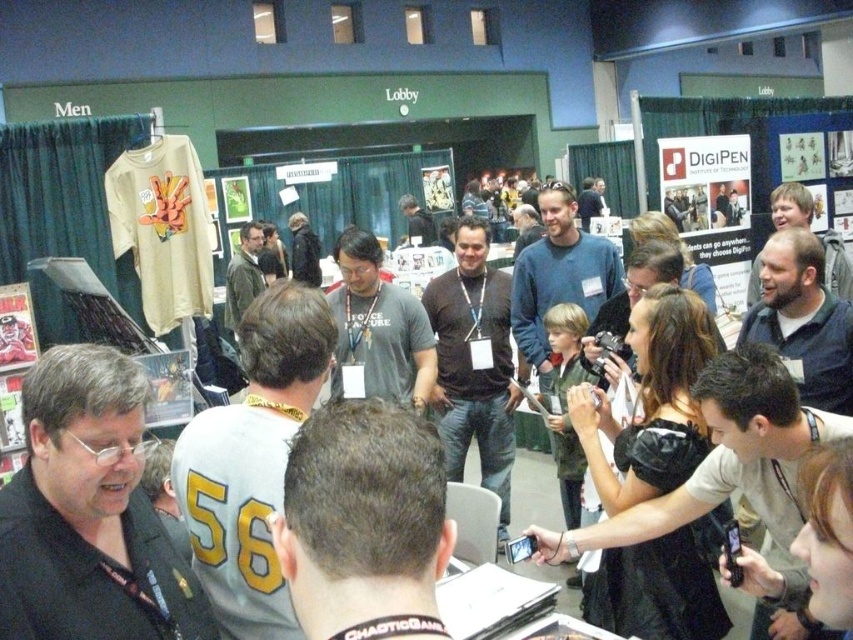
You are at the event and want to take a photo of both the dark blue shirt at center and the blue sweater at center. Which one should you focus on first to ensure both are in clear view?

You should focus on the dark blue shirt at center first since it is closer to you than the blue sweater at center. By focusing on the closer object, both will be in focus if they are within the camera or lens depth of field range.

You are standing at the center of the convention hall and see a dark blue shirt at center. Can you tell me what is located at the point with coordinates (x=804, y=321)?

The dark blue shirt at center is located at point (x=804, y=321).